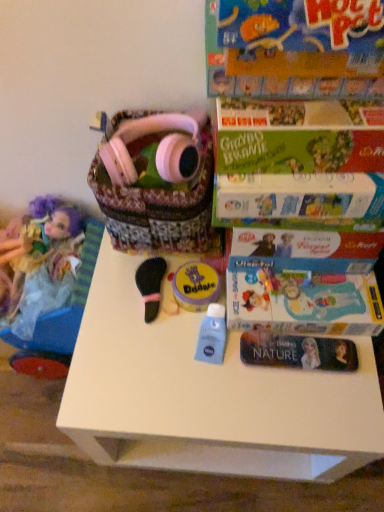
I want to click on free space in front of yellow matte doodle at center, which is counted as the first toy, starting from the right, so [190, 380].